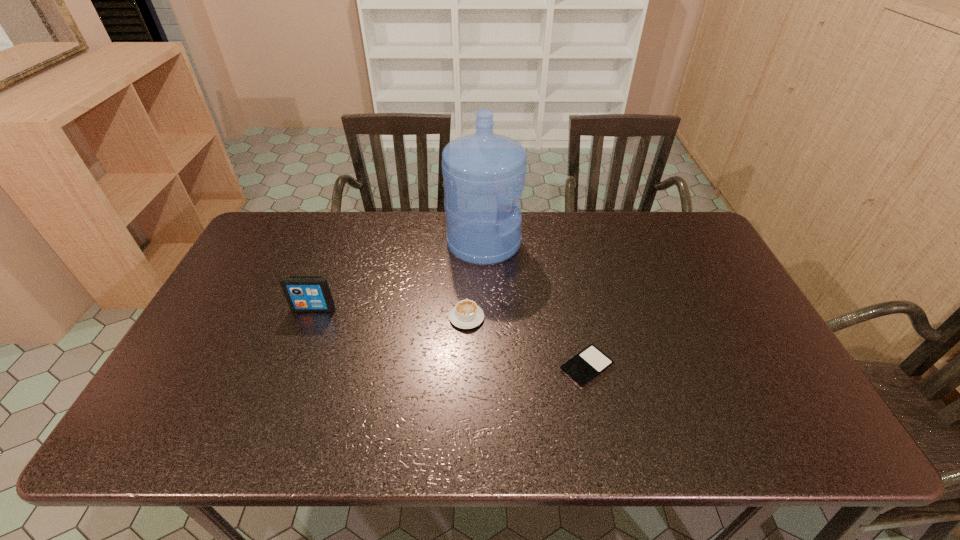
Find the location of a particular element. the tallest object is located at coordinates (484, 173).

Locate an element on the screen. The image size is (960, 540). the farthest object is located at coordinates (484, 173).

The width and height of the screenshot is (960, 540). In order to click on the taller iPod in this screenshot , I will do `click(303, 293)`.

This screenshot has width=960, height=540. I want to click on the second tallest object, so click(303, 293).

At what (x,y) coordinates should I click in order to perform the action: click on cappuccino. Please return your answer as a coordinate pair (x, y). Looking at the image, I should click on (466, 314).

I want to click on the shorter iPod, so click(583, 368).

This screenshot has width=960, height=540. What are the coordinates of `the right iPod` in the screenshot? It's located at pyautogui.click(x=583, y=368).

Locate an element on the screen. Image resolution: width=960 pixels, height=540 pixels. free location located on the side of the water jug with the handle is located at coordinates (640, 243).

Where is `vacant space situated on the front screen of the taller iPod`? The height and width of the screenshot is (540, 960). vacant space situated on the front screen of the taller iPod is located at coordinates (271, 423).

Locate an element on the screen. This screenshot has height=540, width=960. vacant space located 0.060m on the side of the second shortest object with the handle is located at coordinates (468, 291).